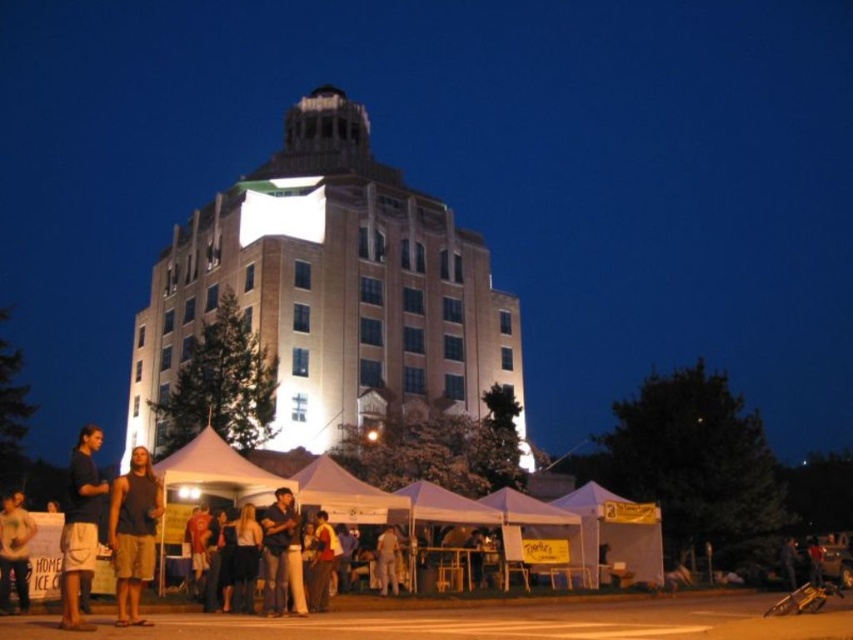
Is dark blue t-shirt at left taller than light brown leather jacket at center?

Yes, dark blue t-shirt at left is taller than light brown leather jacket at center.

Which is in front, point (96, 544) or point (392, 561)?

Positioned in front is point (96, 544).

At what (x,y) coordinates should I click in order to perform the action: click on dark blue t-shirt at left. Please return your answer as a coordinate pair (x, y). The width and height of the screenshot is (853, 640). Looking at the image, I should click on (80, 524).

Who is higher up, white brick building at center or dark blue shirt at center?

white brick building at center is higher up.

Identify the location of white brick building at center. The height and width of the screenshot is (640, 853). (332, 291).

I want to click on white brick building at center, so click(x=332, y=291).

Between dark blue shirt at center and yellow cotton shirt at center, which one has more height?

dark blue shirt at center is taller.

Describe the element at coordinates (281, 556) in the screenshot. I see `dark blue shirt at center` at that location.

Between point (277, 566) and point (326, 573), which one is positioned in front?

Positioned in front is point (277, 566).

Find the location of a particular element. dark blue shirt at center is located at coordinates (281, 556).